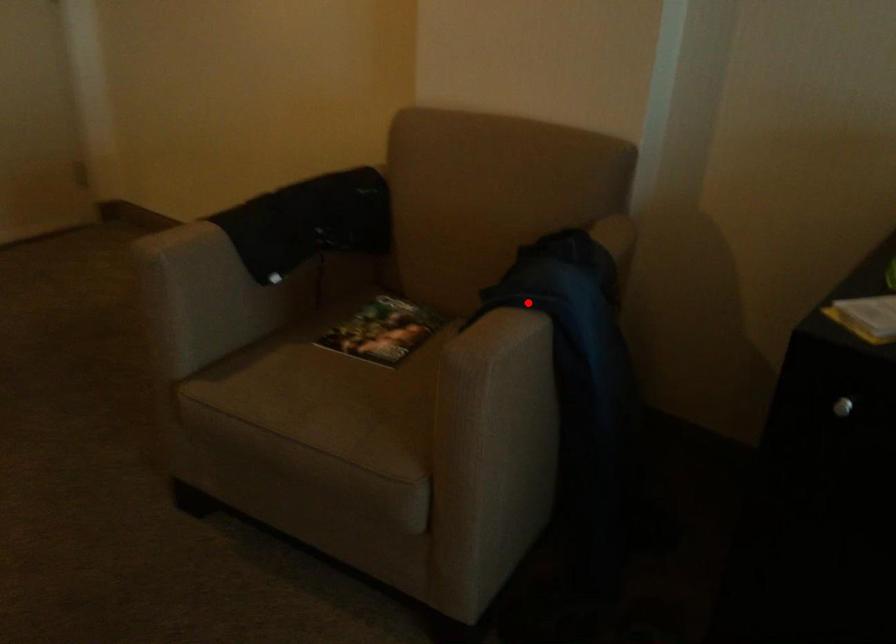
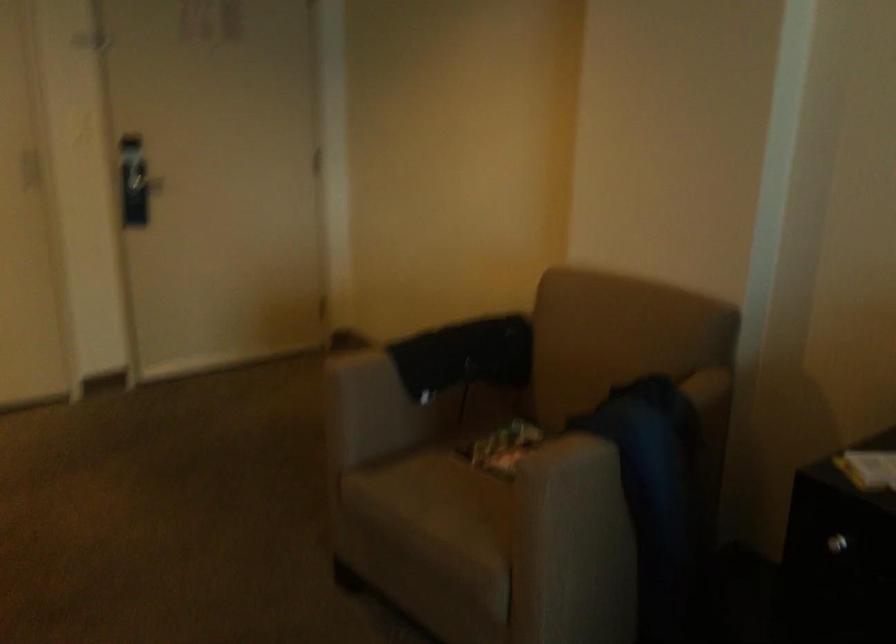
Where in the second image is the point corresponding to the highlighted location from the first image?

(597, 433)